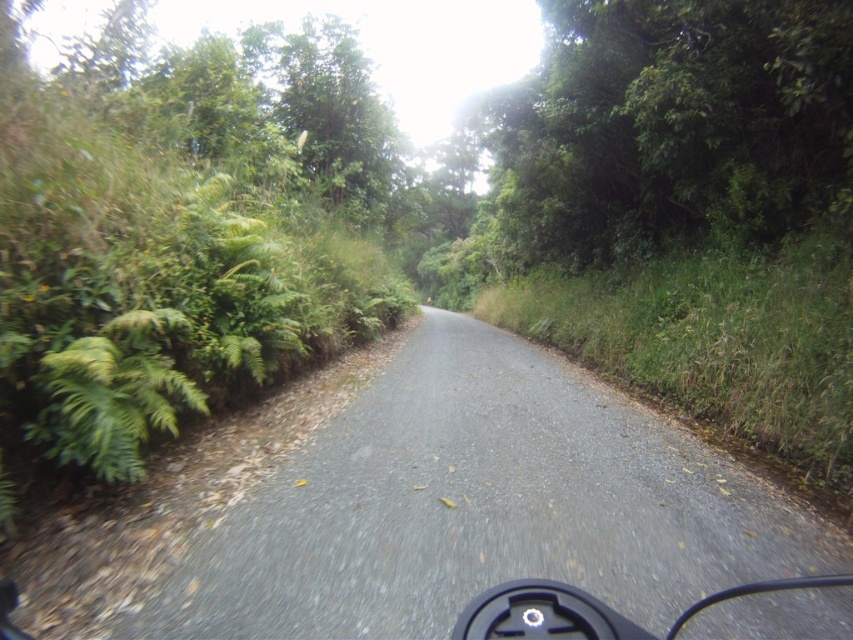
You are riding a bicycle on the gray asphalt road at center and want to reach the green leafy tree at upper center. Which direction should you turn to get closer to the tree?

The gray asphalt road at center is to the left of the green leafy tree at upper center, so you should turn to your right to head towards the tree.

You are navigating a bicycle along the gray asphalt road at center in a forest. You need to reach a specific point marked at coordinates [424,508]. According to the image, is the road at that point directly ahead of you or to the side?

The gray asphalt road at center is located at point [424,508], so the road is directly ahead of you at that point.

You are a cyclist riding along the gray asphalt road at center and notice a green leafy tree at upper center ahead. Which object will appear closer to you as you approach the tree?

The gray asphalt road at center will appear closer to you as you approach the green leafy tree at upper center because the road is shorter than the tree.